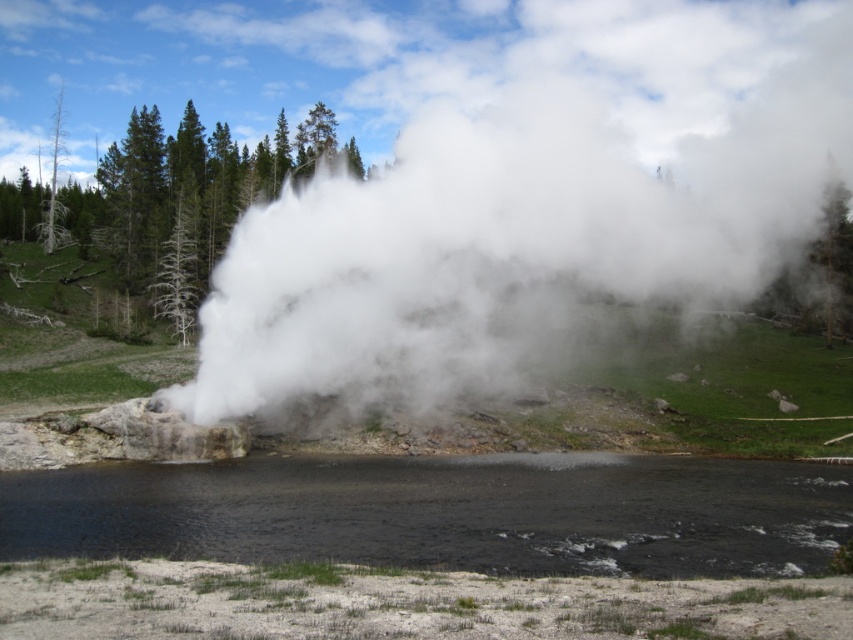
Question: Does white vapor at center have a larger size compared to black liquid at center?

Choices:
 (A) no
 (B) yes

Answer: (B)

Question: Is white vapor at center above black liquid at center?

Choices:
 (A) no
 (B) yes

Answer: (B)

Question: Is white vapor at center thinner than black liquid at center?

Choices:
 (A) yes
 (B) no

Answer: (B)

Question: Which point appears closest to the camera in this image?

Choices:
 (A) (221, 544)
 (B) (553, 305)

Answer: (A)

Question: Which point appears closest to the camera in this image?

Choices:
 (A) (769, 173)
 (B) (250, 483)

Answer: (B)